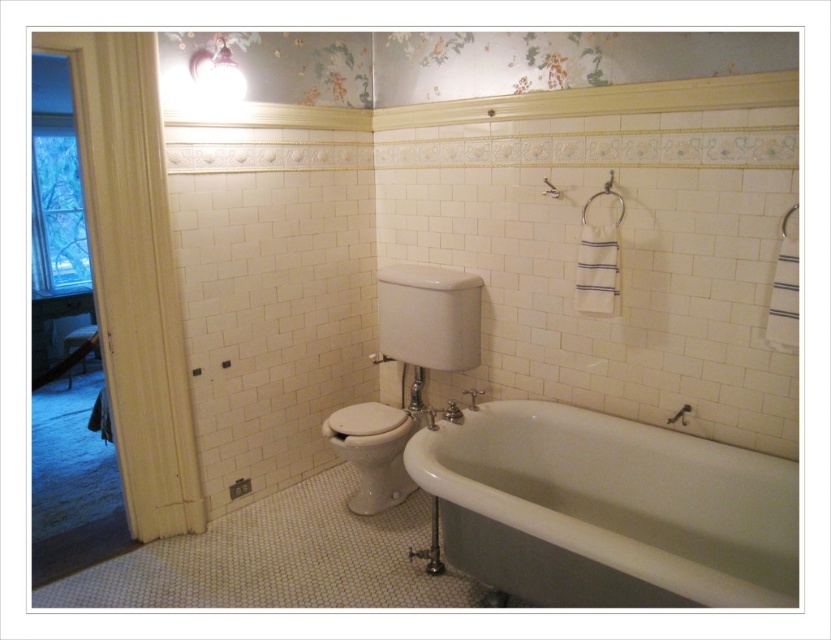
Question: From the image, what is the correct spatial relationship of matte white light fixture at upper center in relation to white metal towel bar at upper right?

Choices:
 (A) below
 (B) above

Answer: (B)

Question: Does white ceramic shower at lower right have a greater width compared to white metal towel bar at upper right?

Choices:
 (A) yes
 (B) no

Answer: (B)

Question: Among these points, which one is farthest from the camera?

Choices:
 (A) (608, 556)
 (B) (682, 410)
 (C) (193, 80)

Answer: (C)

Question: Considering the real-world distances, which object is closest to the white metal towel bar at upper right?

Choices:
 (A) white ceramic shower at lower right
 (B) matte white light fixture at upper center
 (C) white glossy toilet bowl at center
 (D) white porcelain bathtub at lower right

Answer: (C)

Question: Can you confirm if white glossy toilet bowl at center is bigger than white ceramic shower at lower right?

Choices:
 (A) yes
 (B) no

Answer: (A)

Question: Which point appears closest to the camera in this image?

Choices:
 (A) (225, 52)
 (B) (711, 490)
 (C) (379, 502)

Answer: (B)